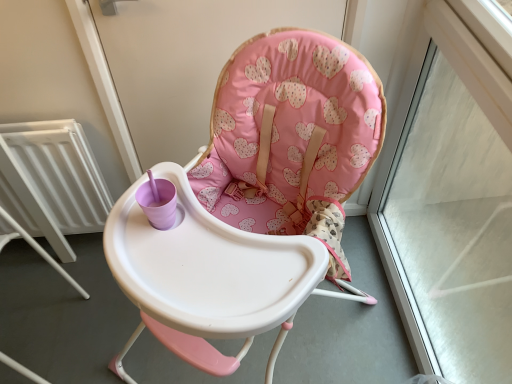
Question: Is point (297, 213) positioned closer to the camera than point (492, 329)?

Choices:
 (A) farther
 (B) closer

Answer: (B)

Question: Relative to transparent glass window frame at upper right, is pink fabric highchair at center in front or behind?

Choices:
 (A) behind
 (B) front

Answer: (B)

Question: Which object is the farthest from the white metallic radiator at left?

Choices:
 (A) pink fabric highchair at center
 (B) transparent glass window frame at upper right
 (C) pink fabric screen door at upper center

Answer: (B)

Question: Which of these objects is positioned farthest from the pink fabric screen door at upper center?

Choices:
 (A) white metallic radiator at left
 (B) pink fabric highchair at center
 (C) transparent glass window frame at upper right

Answer: (C)